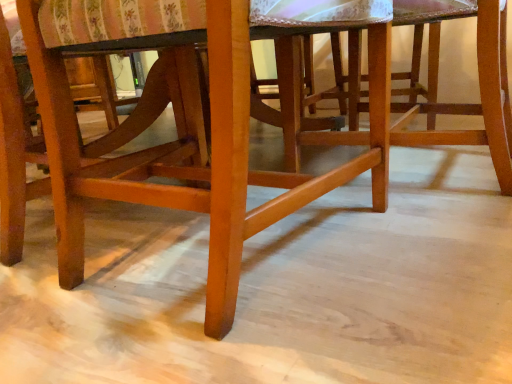
Describe the element at coordinates (187, 125) in the screenshot. I see `wooden chair at center` at that location.

Looking at this image, measure the distance between point (175, 162) and camera.

1.04 meters.

Image resolution: width=512 pixels, height=384 pixels. I want to click on wooden chair at center, so click(x=187, y=125).

Identify the location of wooden stool at center. The width and height of the screenshot is (512, 384). (479, 85).

This screenshot has width=512, height=384. What do you see at coordinates (479, 85) in the screenshot? I see `wooden stool at center` at bounding box center [479, 85].

Locate an element on the screen. wooden chair at center is located at coordinates click(x=187, y=125).

Between wooden chair at center and wooden stool at center, which one appears on the left side from the viewer's perspective?

wooden chair at center is more to the left.

Consider the image. Considering the positions of objects wooden chair at center and wooden stool at center in the image provided, who is in front, wooden chair at center or wooden stool at center?

wooden chair at center is closer to the camera.

Is point (193, 39) positioned behind point (364, 110)?

That is False.

From the image's perspective, between wooden chair at center and wooden stool at center, who is located below?

From the image's view, wooden chair at center is below.

From a real-world perspective, which object stands above the other?

wooden chair at center.

Which object is thinner, wooden chair at center or wooden stool at center?

wooden stool at center.

Considering the sizes of objects wooden chair at center and wooden stool at center in the image provided, who is shorter, wooden chair at center or wooden stool at center?

Standing shorter between the two is wooden stool at center.

Who is bigger, wooden chair at center or wooden stool at center?

With larger size is wooden chair at center.

In the scene shown: Is wooden chair at center not within wooden stool at center?

wooden chair at center lies outside wooden stool at center's area.

Is wooden chair at center positioned far away from wooden stool at center?

They are positioned close to each other.

Looking at this image, is wooden chair at center facing away from wooden stool at center?

No, wooden chair at center is not facing away from wooden stool at center.

How different are the orientations of wooden chair at center and wooden stool at center in degrees?

wooden chair at center and wooden stool at center are facing 88.6 degrees away from each other.

Measure the distance from wooden chair at center to wooden stool at center.

They are 33.78 centimeters apart.

The image size is (512, 384). In order to click on stool on the right of wooden chair at center in this screenshot , I will do `click(479, 85)`.

Which object is positioned more to the right, wooden stool at center or wooden chair at center?

wooden stool at center.

Is wooden stool at center in front of or behind wooden chair at center in the image?

Visually, wooden stool at center is located behind wooden chair at center.

Which is farther, (496, 157) or (233, 8)?

Point (496, 157)

From the image's perspective, which is below, wooden stool at center or wooden chair at center?

wooden chair at center is shown below in the image.

From the picture: From a real-world perspective, does wooden stool at center sit lower than wooden chair at center?

Yes, from a real-world perspective, wooden stool at center is under wooden chair at center.

Is wooden stool at center wider than wooden chair at center?

In fact, wooden stool at center might be narrower than wooden chair at center.

Considering the relative sizes of wooden stool at center and wooden chair at center in the image provided, is wooden stool at center taller than wooden chair at center?

No, wooden stool at center is not taller than wooden chair at center.

In the scene shown: Considering the relative sizes of wooden stool at center and wooden chair at center in the image provided, is wooden stool at center bigger than wooden chair at center?

Actually, wooden stool at center might be smaller than wooden chair at center.

Based on the photo, is wooden stool at center situated inside wooden chair at center or outside?

wooden stool at center is not enclosed by wooden chair at center.

Is the surface of wooden stool at center in direct contact with wooden chair at center?

wooden stool at center and wooden chair at center are clearly separated.

Is wooden chair at center at the back of wooden stool at center?

wooden stool at center does not have its back to wooden chair at center.

How different are the orientations of wooden stool at center and wooden chair at center in degrees?

The facing directions of wooden stool at center and wooden chair at center are 88.6 degrees apart.

Where is `chair above the wooden stool at center (from a real-world perspective)`? chair above the wooden stool at center (from a real-world perspective) is located at coordinates (187, 125).

Where is `chair above the wooden stool at center (from a real-world perspective)`? This screenshot has height=384, width=512. chair above the wooden stool at center (from a real-world perspective) is located at coordinates (187, 125).

This screenshot has height=384, width=512. Find the location of `stool that is above the wooden chair at center (from the image's perspective)`. stool that is above the wooden chair at center (from the image's perspective) is located at coordinates (479, 85).